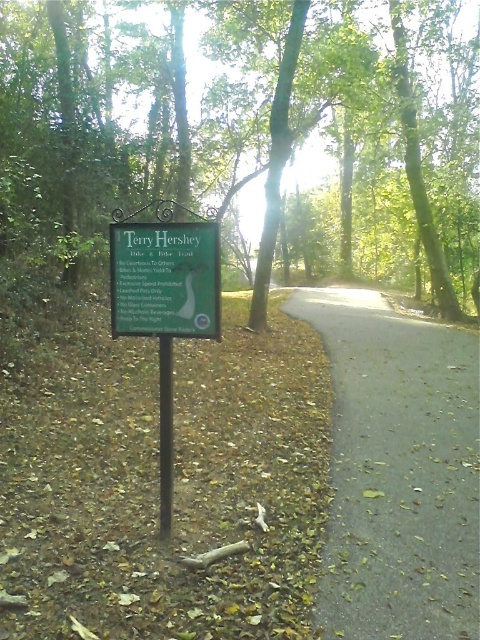
Can you confirm if green leafy tree at center is shorter than green matte signpost at center?

No, green leafy tree at center is not shorter than green matte signpost at center.

Locate an element on the screen. The image size is (480, 640). green leafy tree at center is located at coordinates (238, 125).

Is gray asphalt road at center wider than green wood sign at center?

Correct, the width of gray asphalt road at center exceeds that of green wood sign at center.

The image size is (480, 640). Describe the element at coordinates (397, 470) in the screenshot. I see `gray asphalt road at center` at that location.

This screenshot has width=480, height=640. In order to click on gray asphalt road at center in this screenshot , I will do `click(397, 470)`.

Who is shorter, green leafy tree at center or gray asphalt road at center?

gray asphalt road at center

In the scene shown: Does green leafy tree at center have a greater width compared to gray asphalt road at center?

Indeed, green leafy tree at center has a greater width compared to gray asphalt road at center.

Is point (224, 33) positioned after point (400, 611)?

Yes, point (224, 33) is behind point (400, 611).

At what (x,y) coordinates should I click in order to perform the action: click on green leafy tree at center. Please return your answer as a coordinate pair (x, y). The image size is (480, 640). Looking at the image, I should click on (238, 125).